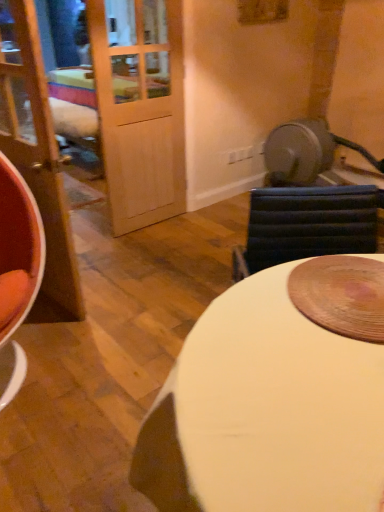
The image size is (384, 512). I want to click on free space above white glossy table at center (from a real-world perspective), so click(299, 337).